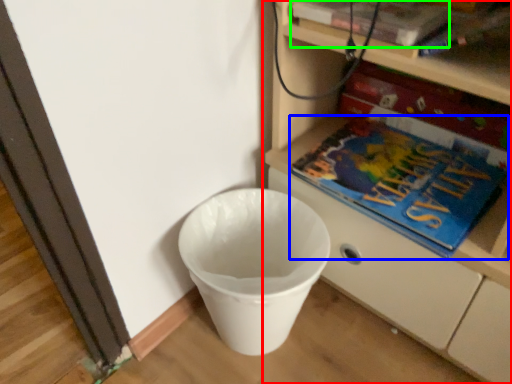
Question: Estimate the real-world distances between objects in this image. Which object is farther from shelf (highlighted by a red box), book (highlighted by a blue box) or paperback book (highlighted by a green box)?

Choices:
 (A) book
 (B) paperback book

Answer: (B)